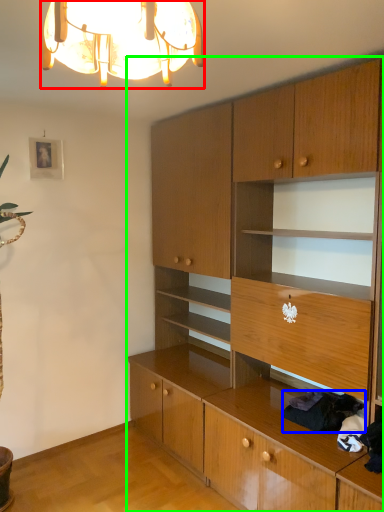
Question: Based on their relative distances, which object is farther from lamp (highlighted by a red box)? Choose from clothing (highlighted by a blue box) and cabinetry (highlighted by a green box).

Choices:
 (A) clothing
 (B) cabinetry

Answer: (A)